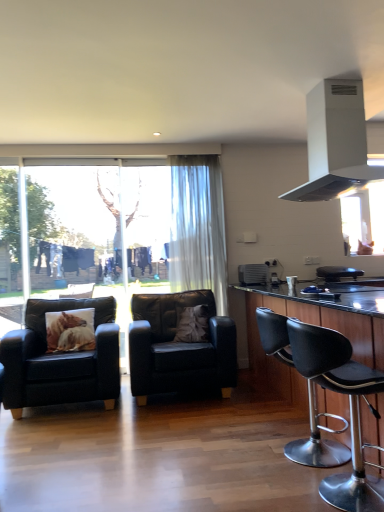
Question: Can you confirm if matte black armchair at left, acting as the third chair starting from the back, is wider than satin silver air conditioner at center?

Choices:
 (A) yes
 (B) no

Answer: (A)

Question: Is matte black armchair at left, the 2th chair when ordered from front to back, far from satin silver air conditioner at center?

Choices:
 (A) no
 (B) yes

Answer: (B)

Question: From a real-world perspective, is matte black armchair at left, the 4th chair from the right, located higher than satin silver air conditioner at center?

Choices:
 (A) no
 (B) yes

Answer: (A)

Question: Does matte black armchair at left, acting as the third chair starting from the back, have a larger size compared to satin silver air conditioner at center?

Choices:
 (A) no
 (B) yes

Answer: (B)

Question: Is matte black armchair at left, acting as the third chair starting from the back, smaller than satin silver air conditioner at center?

Choices:
 (A) yes
 (B) no

Answer: (B)

Question: Looking at the image, does sheer white curtain at center seem bigger or smaller compared to black leather chair at center, which is the first chair in right-to-left order?

Choices:
 (A) big
 (B) small

Answer: (A)

Question: Considering their positions, is sheer white curtain at center located in front of or behind black leather chair at center, marked as the fourth chair in a front-to-back arrangement?

Choices:
 (A) front
 (B) behind

Answer: (B)

Question: From a real-world perspective, is sheer white curtain at center positioned above or below black leather chair at center, the 4th chair when ordered from left to right?

Choices:
 (A) above
 (B) below

Answer: (A)

Question: From the image's perspective, is sheer white curtain at center above or below black leather chair at center, acting as the 1th chair starting from the back?

Choices:
 (A) below
 (B) above

Answer: (B)

Question: Is point (317, 275) closer or farther from the camera than point (163, 329)?

Choices:
 (A) closer
 (B) farther

Answer: (B)

Question: Is black leather chair at center, which is the first chair in right-to-left order, taller or shorter than black leather chair at center, the 3th chair positioned from the front?

Choices:
 (A) tall
 (B) short

Answer: (B)

Question: Considering the positions of black leather chair at center, marked as the fourth chair in a front-to-back arrangement, and black leather chair at center, the 2th chair positioned from the left, in the image, is black leather chair at center, marked as the fourth chair in a front-to-back arrangement, bigger or smaller than black leather chair at center, the 2th chair positioned from the left,?

Choices:
 (A) big
 (B) small

Answer: (B)

Question: From a real-world perspective, is black leather chair at center, marked as the fourth chair in a front-to-back arrangement, above or below black leather chair at center, the 3th chair positioned from the front?

Choices:
 (A) above
 (B) below

Answer: (A)

Question: From a real-world perspective, is black leather chair at center, which ranks as the 3th chair in right-to-left order, physically located above or below black leather cabinet at right?

Choices:
 (A) above
 (B) below

Answer: (B)

Question: In terms of width, does black leather chair at center, which is the second chair in back-to-front order, look wider or thinner when compared to black leather cabinet at right?

Choices:
 (A) thin
 (B) wide

Answer: (A)